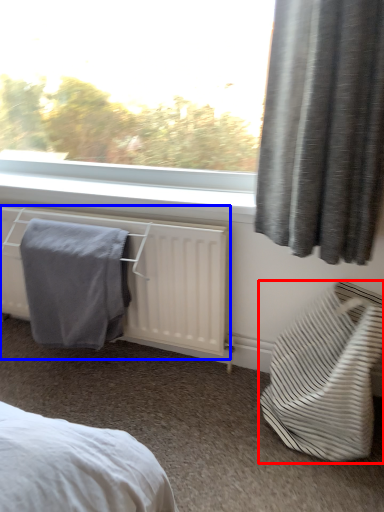
Question: Among these objects, which one is nearest to the camera, furniture (highlighted by a red box) or radiator (highlighted by a blue box)?

Choices:
 (A) furniture
 (B) radiator

Answer: (A)